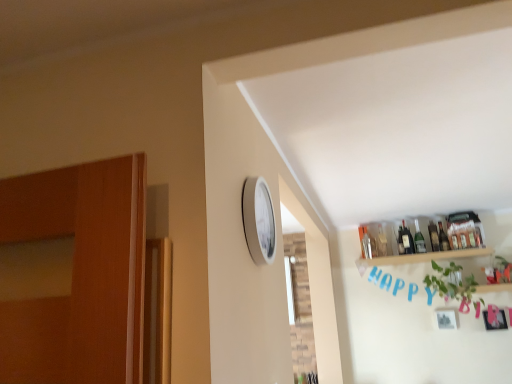
In order to face green leafy plant at upper right, should I rotate leftwards or rightwards?

To face it directly, rotate right by 24.769 degrees.

What do you see at coordinates (419, 239) in the screenshot? The height and width of the screenshot is (384, 512). I see `green glass bottle at upper right, the 3th bottle positioned from the right` at bounding box center [419, 239].

What is the approximate height of translucent glass bottle at upper right, marked as the first bottle in a right-to-left arrangement?

translucent glass bottle at upper right, marked as the first bottle in a right-to-left arrangement, is 11.38 inches in height.

You are a GUI agent. You are given a task and a screenshot of the screen. Output one action in this format:
    pyautogui.click(x=<x>, y=<y>)
    Task: Click on the wooden shelf at upper right
    This screenshot has height=384, width=512.
    Given the screenshot: What is the action you would take?
    pyautogui.click(x=421, y=257)

At what (x,y) coordinates should I click in order to perform the action: click on shelf above the green leafy plant at upper right (from a real-world perspective). Please return your answer as a coordinate pair (x, y). The width and height of the screenshot is (512, 384). Looking at the image, I should click on (421, 257).

Does green leafy plant at upper right lie behind wooden shelf at upper right?

No, it is not.

Are green leafy plant at upper right and wooden shelf at upper right located far from each other?

green leafy plant at upper right is near wooden shelf at upper right, not far away.

Considering the relative positions of green leafy plant at upper right and wooden shelf at upper right in the image provided, is green leafy plant at upper right to the left or to the right of wooden shelf at upper right?

green leafy plant at upper right is positioned on wooden shelf at upper right's right side.

Can you tell me how much green glass bottle at upper right, acting as the second bottle starting from the right, and green leafy plant at upper right differ in facing direction?

0.00139 degrees separate the facing orientations of green glass bottle at upper right, acting as the second bottle starting from the right, and green leafy plant at upper right.

From the image's perspective, is green glass bottle at upper right, acting as the second bottle starting from the right, located above or below green leafy plant at upper right?

Based on their image positions, green glass bottle at upper right, acting as the second bottle starting from the right, is located above green leafy plant at upper right.

Which of these two, green glass bottle at upper right, the third bottle when ordered from left to right, or green leafy plant at upper right, stands taller?

With more height is green leafy plant at upper right.

The width and height of the screenshot is (512, 384). I want to click on the 2nd bottle located above the green leafy plant at upper right (from a real-world perspective), so click(x=433, y=236).

Locate an element on the screen. This screenshot has height=384, width=512. shelf behind the white plastic clock at upper center is located at coordinates (421, 257).

Is point (369, 266) in front of point (244, 196)?

No, it is not.

Looking at this image, does wooden shelf at upper right lie behind white plastic clock at upper center?

Yes, wooden shelf at upper right is further from the viewer.

Can you tell me how much wooden shelf at upper right and white plastic clock at upper center differ in facing direction?

wooden shelf at upper right and white plastic clock at upper center are facing 88.7 degrees away from each other.

Does green glass bottle at upper right, the 2th bottle when ordered from left to right, touch translucent glass bottle at upper right, marked as the first bottle in a right-to-left arrangement?

No, green glass bottle at upper right, the 2th bottle when ordered from left to right, is not in contact with translucent glass bottle at upper right, marked as the first bottle in a right-to-left arrangement.

Is green glass bottle at upper right, the 2th bottle when ordered from left to right, located outside translucent glass bottle at upper right, which is counted as the fourth bottle, starting from the left?

That's correct, green glass bottle at upper right, the 2th bottle when ordered from left to right, is outside of translucent glass bottle at upper right, which is counted as the fourth bottle, starting from the left.

From the image's perspective, which bottle is the 1st one below the translucent glass bottle at upper right, which is counted as the fourth bottle, starting from the left? Please provide its 2D coordinates.

[(419, 239)]

Relative to translucent glass bottle at upper right, marked as the first bottle in a right-to-left arrangement, is green glass bottle at upper right, the 2th bottle when ordered from left to right, in front or behind?

Visually, green glass bottle at upper right, the 2th bottle when ordered from left to right, is located in front of translucent glass bottle at upper right, marked as the first bottle in a right-to-left arrangement.

Is translucent glass bottle at upper right, marked as the first bottle in a right-to-left arrangement, oriented away from green leafy plant at upper right?

translucent glass bottle at upper right, marked as the first bottle in a right-to-left arrangement, does not have its back to green leafy plant at upper right.

From a real-world perspective, which object stands above the other?

In real-world perspective, translucent glass bottle at upper right, which is counted as the fourth bottle, starting from the left, is above.

Are translucent glass bottle at upper right, marked as the first bottle in a right-to-left arrangement, and green leafy plant at upper right far apart?

No, translucent glass bottle at upper right, marked as the first bottle in a right-to-left arrangement, is not far from green leafy plant at upper right.

Would you say green glass bottle at upper right, the 2th bottle when ordered from left to right, is outside white plastic clock at upper center?

green glass bottle at upper right, the 2th bottle when ordered from left to right, is positioned outside white plastic clock at upper center.

Considering the sizes of objects green glass bottle at upper right, the 3th bottle positioned from the right, and white plastic clock at upper center in the image provided, who is thinner, green glass bottle at upper right, the 3th bottle positioned from the right, or white plastic clock at upper center?

With smaller width is white plastic clock at upper center.

What's the angular difference between green glass bottle at upper right, the 2th bottle when ordered from left to right, and white plastic clock at upper center's facing directions?

88.7 degrees separate the facing orientations of green glass bottle at upper right, the 2th bottle when ordered from left to right, and white plastic clock at upper center.

Is green glass bottle at upper right, the 3th bottle positioned from the right, positioned with its back to white plastic clock at upper center?

No, white plastic clock at upper center is not at the back of green glass bottle at upper right, the 3th bottle positioned from the right.

Looking at this image, can you see translucent glass bottle at upper right, marked as the first bottle in a right-to-left arrangement, touching white plastic clock at upper center?

No, translucent glass bottle at upper right, marked as the first bottle in a right-to-left arrangement, is not beside white plastic clock at upper center.

Where is `clock below the translucent glass bottle at upper right, which is counted as the fourth bottle, starting from the left (from a real-world perspective)`? clock below the translucent glass bottle at upper right, which is counted as the fourth bottle, starting from the left (from a real-world perspective) is located at coordinates (258, 220).

Is white plastic clock at upper center inside translucent glass bottle at upper right, which is counted as the fourth bottle, starting from the left?

No, white plastic clock at upper center is located outside of translucent glass bottle at upper right, which is counted as the fourth bottle, starting from the left.

You are a GUI agent. You are given a task and a screenshot of the screen. Output one action in this format:
    pyautogui.click(x=<x>, y=<y>)
    Task: Click on the plant located underneath the wooden shelf at upper right (from a real-world perspective)
    The height and width of the screenshot is (384, 512).
    Given the screenshot: What is the action you would take?
    pyautogui.click(x=451, y=284)

From the green leafy plant at upper right, count the 1st bottle to the left and point to it. Please provide its 2D coordinates.

[(433, 236)]

From the image, which object appears to be nearer to white plastic clock at upper center, translucent glass bottle at upper right, which ranks as the 4th bottle in right-to-left order, or green glass bottle at upper right, the third bottle when ordered from left to right?

translucent glass bottle at upper right, which ranks as the 4th bottle in right-to-left order, lies closer to white plastic clock at upper center than the other object.

Based on their spatial positions, is wooden shelf at upper right or green glass bottle at upper right, the 2th bottle when ordered from left to right, further from translucent glass bottle at upper right, which is counted as the fourth bottle, starting from the left?

wooden shelf at upper right is further to translucent glass bottle at upper right, which is counted as the fourth bottle, starting from the left.

When comparing their distances from translucent glass bottle at upper right, which is counted as the fourth bottle, starting from the left, does wooden shelf at upper right or green glass bottle at upper right, the third bottle when ordered from left to right, seem closer?

Among the two, green glass bottle at upper right, the third bottle when ordered from left to right, is located nearer to translucent glass bottle at upper right, which is counted as the fourth bottle, starting from the left.

When comparing their distances from green glass bottle at upper right, the 2th bottle when ordered from left to right, does wooden shelf at upper right or translucent glass bottle at upper right, marked as the first bottle in a right-to-left arrangement, seem closer?

translucent glass bottle at upper right, marked as the first bottle in a right-to-left arrangement.

Looking at the image, which one is located closer to wooden shelf at upper right, translucent glass bottle at upper right, the 1th bottle in the left-to-right sequence, or white plastic clock at upper center?

Among the two, translucent glass bottle at upper right, the 1th bottle in the left-to-right sequence, is located nearer to wooden shelf at upper right.

Which object lies further to the anchor point green leafy plant at upper right, translucent glass bottle at upper right, marked as the first bottle in a right-to-left arrangement, or translucent glass bottle at upper right, the 1th bottle in the left-to-right sequence?

Among the two, translucent glass bottle at upper right, the 1th bottle in the left-to-right sequence, is located further to green leafy plant at upper right.

Considering their positions, is green leafy plant at upper right positioned closer to translucent glass bottle at upper right, which ranks as the 4th bottle in right-to-left order, than green glass bottle at upper right, the 2th bottle when ordered from left to right?

The object closer to translucent glass bottle at upper right, which ranks as the 4th bottle in right-to-left order, is green glass bottle at upper right, the 2th bottle when ordered from left to right.

Based on their spatial positions, is translucent glass bottle at upper right, marked as the first bottle in a right-to-left arrangement, or wooden shelf at upper right closer to green glass bottle at upper right, acting as the second bottle starting from the right?

translucent glass bottle at upper right, marked as the first bottle in a right-to-left arrangement, is closer to green glass bottle at upper right, acting as the second bottle starting from the right.

You are a GUI agent. You are given a task and a screenshot of the screen. Output one action in this format:
    pyautogui.click(x=<x>, y=<y>)
    Task: Click on the plant between white plastic clock at upper center and green glass bottle at upper right, the 3th bottle positioned from the right, in the front-back direction
    
    Given the screenshot: What is the action you would take?
    pyautogui.click(x=451, y=284)

Where is `shelf between white plastic clock at upper center and green glass bottle at upper right, the 2th bottle when ordered from left to right, from front to back`? This screenshot has width=512, height=384. shelf between white plastic clock at upper center and green glass bottle at upper right, the 2th bottle when ordered from left to right, from front to back is located at coordinates (421, 257).

At what (x,y) coordinates should I click in order to perform the action: click on shelf between green glass bottle at upper right, the third bottle when ordered from left to right, and green leafy plant at upper right from top to bottom. Please return your answer as a coordinate pair (x, y). Looking at the image, I should click on (421, 257).

Locate an element on the screen. The image size is (512, 384). shelf between white plastic clock at upper center and green glass bottle at upper right, the third bottle when ordered from left to right, along the z-axis is located at coordinates (421, 257).